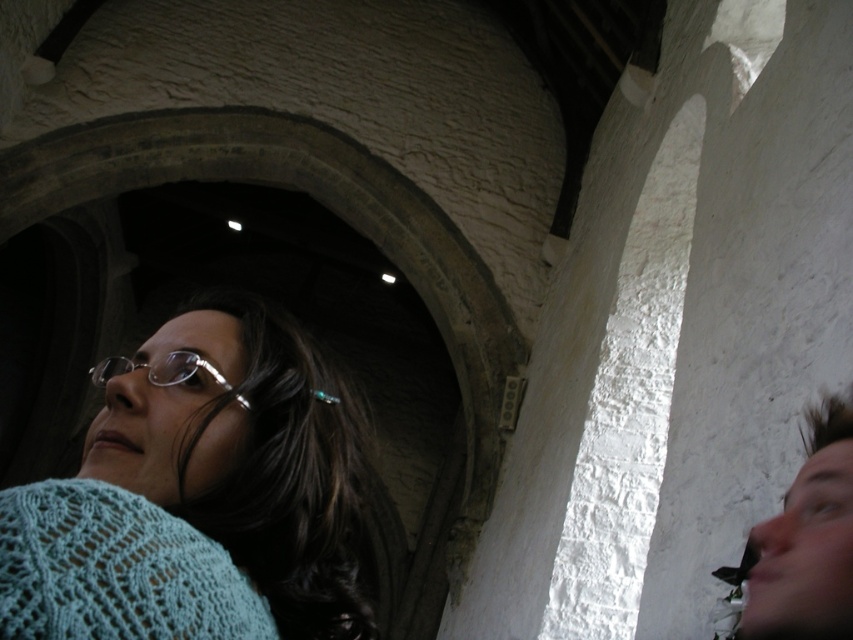
Does knitted light blue sweater at lower left have a smaller size compared to smooth brown hair at right?

Yes.

Who is shorter, knitted light blue sweater at lower left or smooth brown hair at right?

Standing shorter between the two is knitted light blue sweater at lower left.

Measure the distance between knitted light blue sweater at lower left and camera.

A distance of 8.06 meters exists between knitted light blue sweater at lower left and camera.

Image resolution: width=853 pixels, height=640 pixels. Find the location of `knitted light blue sweater at lower left`. knitted light blue sweater at lower left is located at coordinates (196, 496).

Can you confirm if smooth brown hair at right is wider than silver metallic glasses at center?

No, smooth brown hair at right is not wider than silver metallic glasses at center.

Which is more to the right, smooth brown hair at right or silver metallic glasses at center?

smooth brown hair at right

Who is more distant from viewer, (807, 461) or (187, 365)?

Point (187, 365)

This screenshot has height=640, width=853. I want to click on smooth brown hair at right, so click(x=807, y=541).

Looking at this image, is knitted light blue sweater at lower left to the right of silver metallic glasses at center from the viewer's perspective?

Indeed, knitted light blue sweater at lower left is positioned on the right side of silver metallic glasses at center.

Is knitted light blue sweater at lower left taller than silver metallic glasses at center?

Correct, knitted light blue sweater at lower left is much taller as silver metallic glasses at center.

Is point (149, 477) positioned in front of point (189, 358)?

Yes, point (149, 477) is closer to viewer.

This screenshot has width=853, height=640. I want to click on knitted light blue sweater at lower left, so click(196, 496).